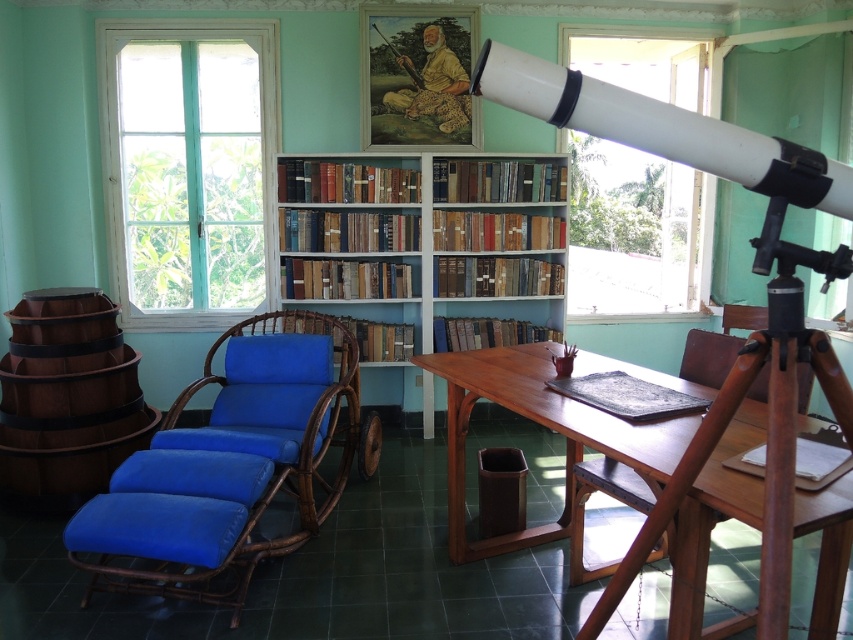
Describe the element at coordinates (543, 424) in the screenshot. I see `wooden table at center` at that location.

Is wooden table at center below blue fabric armchair at center?

No.

The width and height of the screenshot is (853, 640). What do you see at coordinates (543, 424) in the screenshot?
I see `wooden table at center` at bounding box center [543, 424].

Where is `wooden table at center`? The height and width of the screenshot is (640, 853). wooden table at center is located at coordinates (543, 424).

Which is above, blue woven armchair at center or transparent glass window at upper right?

Positioned higher is transparent glass window at upper right.

Which of these two, blue woven armchair at center or transparent glass window at upper right, stands shorter?

blue woven armchair at center

Does point (235, 500) come farther from viewer compared to point (685, 177)?

No, it is not.

At what (x,y) coordinates should I click in order to perform the action: click on blue woven armchair at center. Please return your answer as a coordinate pair (x, y). Looking at the image, I should click on (265, 428).

Between white wooden window at left and blue woven armchair at center, which one has less height?

With less height is white wooden window at left.

Does white wooden window at left appear on the left side of blue woven armchair at center?

Indeed, white wooden window at left is positioned on the left side of blue woven armchair at center.

Describe the element at coordinates (189, 168) in the screenshot. This screenshot has width=853, height=640. I see `white wooden window at left` at that location.

Find the location of a particular element. The image size is (853, 640). white wooden window at left is located at coordinates (189, 168).